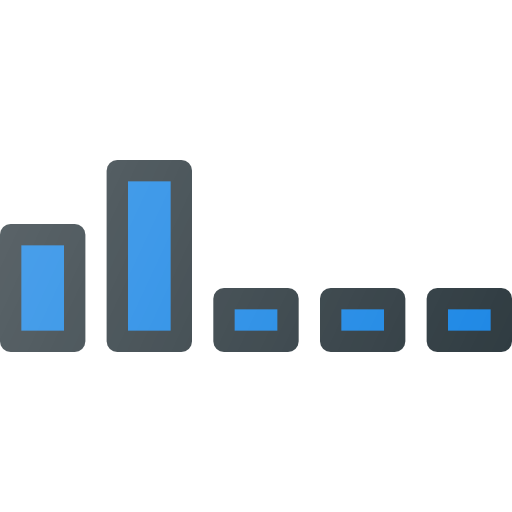
I want to click on corner, so click(x=61, y=246), click(x=167, y=181), click(x=274, y=309), click(x=379, y=309), click(x=488, y=311).